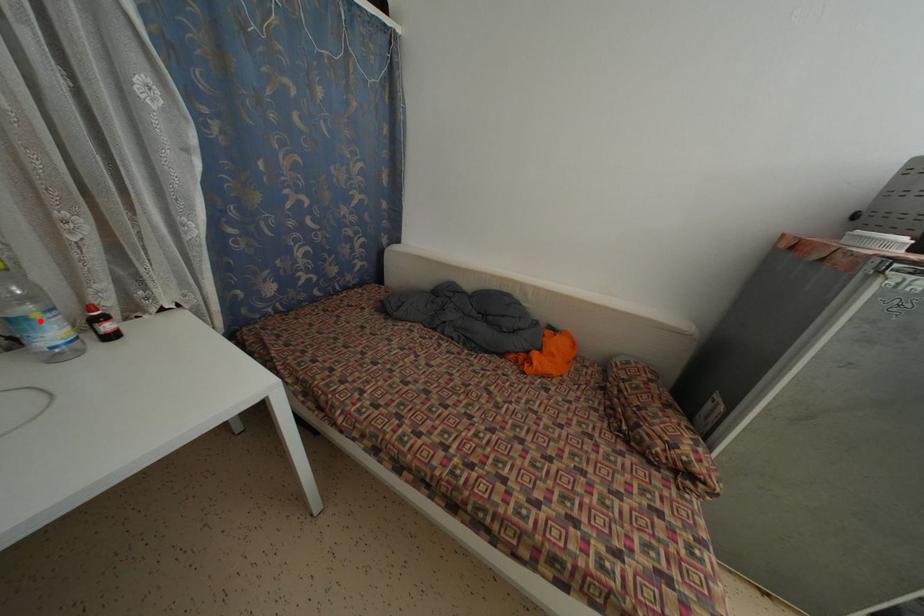
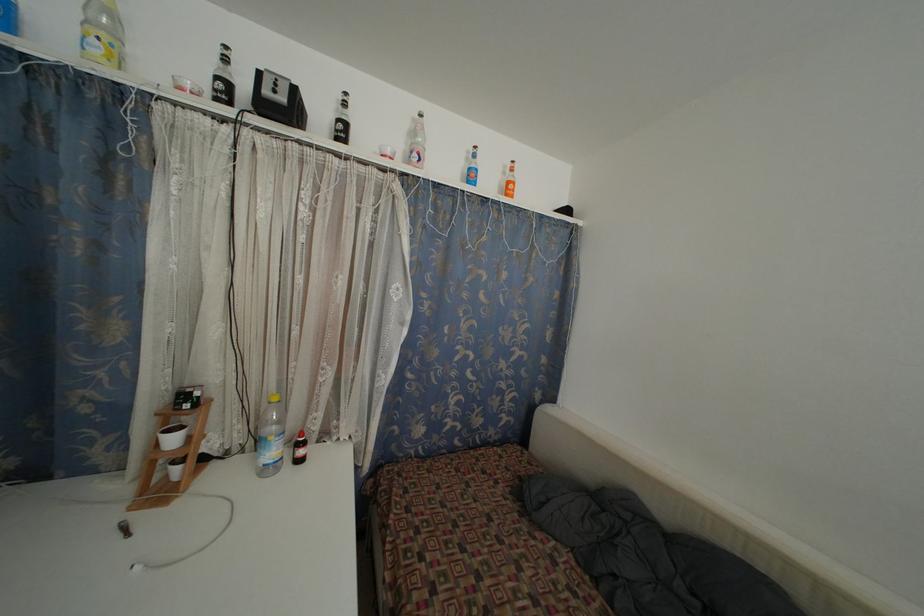
The point at the highlighted location is marked in the first image. Where is the corresponding point in the second image?

(274, 444)